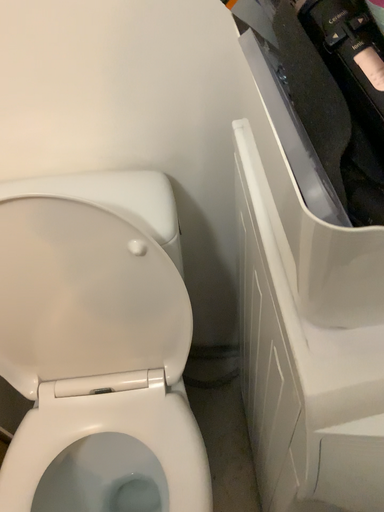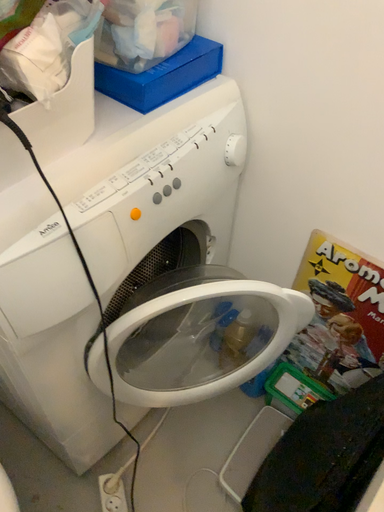
Question: How did the camera likely rotate when shooting the video?

Choices:
 (A) rotated downward
 (B) rotated upward

Answer: (B)